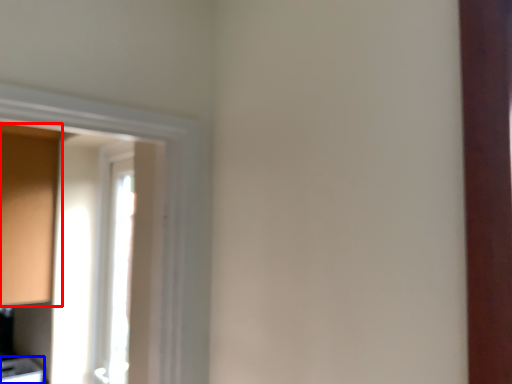
Question: Which object is further to the camera taking this photo, cabinetry (highlighted by a red box) or cabinetry (highlighted by a blue box)?

Choices:
 (A) cabinetry
 (B) cabinetry

Answer: (B)